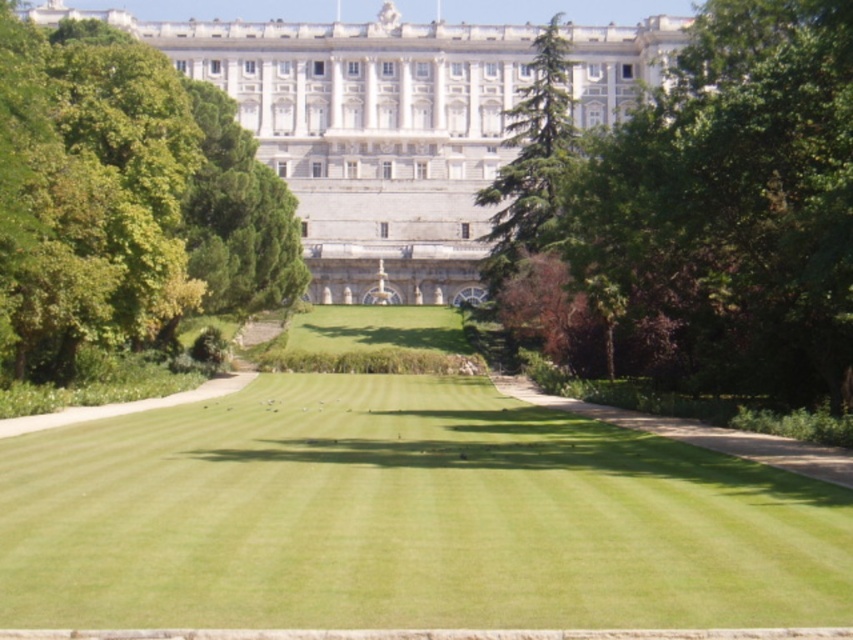
Between green leafy tree at upper center and green leafy tree at upper left, which one is positioned higher?

Positioned higher is green leafy tree at upper center.

Between point (778, 132) and point (227, 273), which one is positioned in front?

Point (778, 132)

Identify the location of green leafy tree at upper center. (701, 218).

Which is more to the right, green leafy tree at upper left or white stone palace at upper center?

From the viewer's perspective, white stone palace at upper center appears more on the right side.

Locate an element on the screen. The image size is (853, 640). green leafy tree at upper left is located at coordinates (125, 198).

Is point (42, 250) farther from camera compared to point (494, 26)?

No, (42, 250) is in front of (494, 26).

This screenshot has height=640, width=853. What are the coordinates of `green leafy tree at upper left` in the screenshot? It's located at (125, 198).

Is green leafy tree at upper center further to camera compared to white stone palace at upper center?

No.

The height and width of the screenshot is (640, 853). Find the location of `green leafy tree at upper center`. green leafy tree at upper center is located at coordinates (701, 218).

Locate an element on the screen. green leafy tree at upper center is located at coordinates (701, 218).